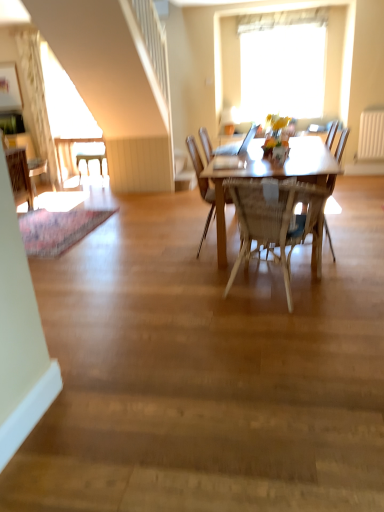
Image resolution: width=384 pixels, height=512 pixels. I want to click on free space in front of wooden chair at center, which is the fifth chair in left-to-right order, so click(x=353, y=265).